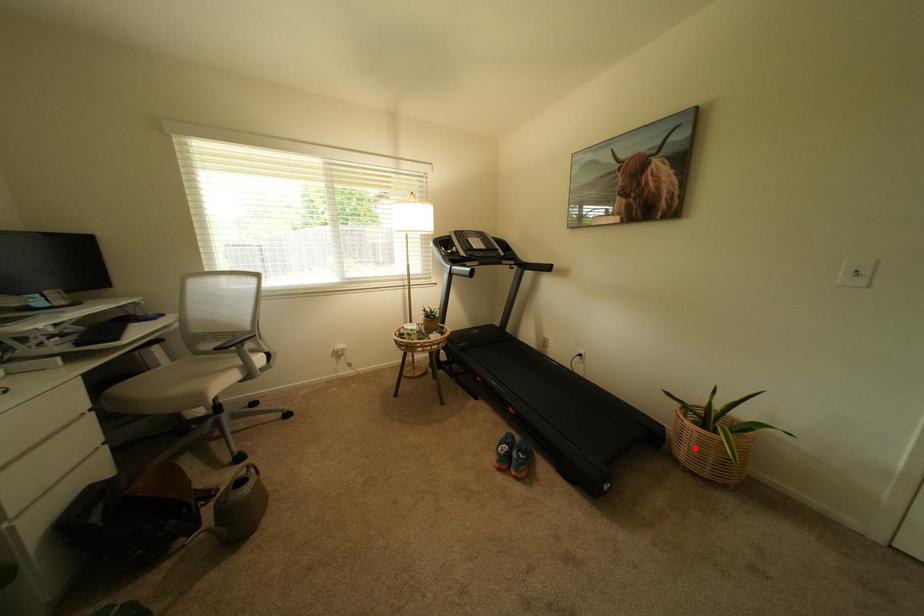
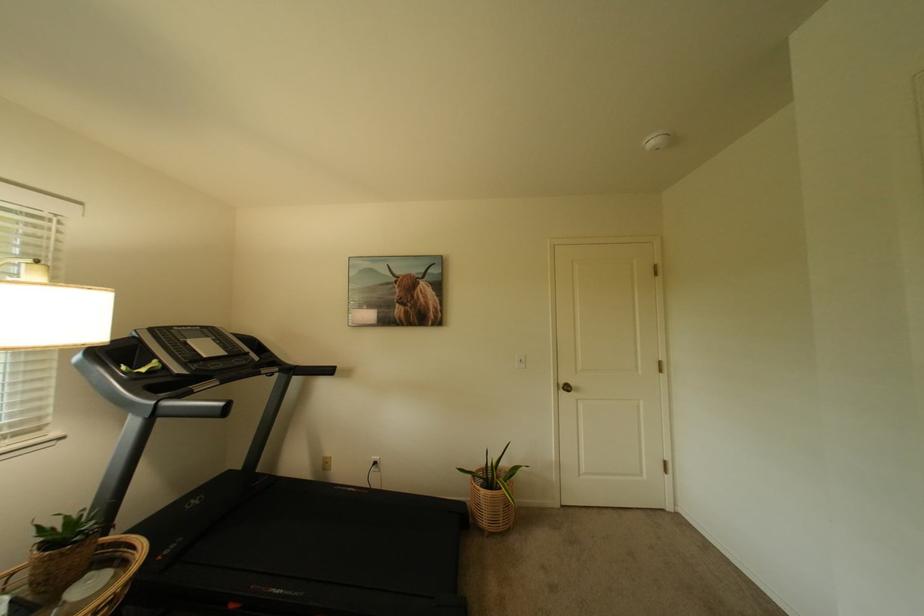
Question: I am providing you with two images of the same scene from different viewpoints. Given a red point in image1, look at the same physical point in image2. Is it:

Choices:
 (A) Closer to the viewpoint
 (B) Farther from the viewpoint

Answer: (B)